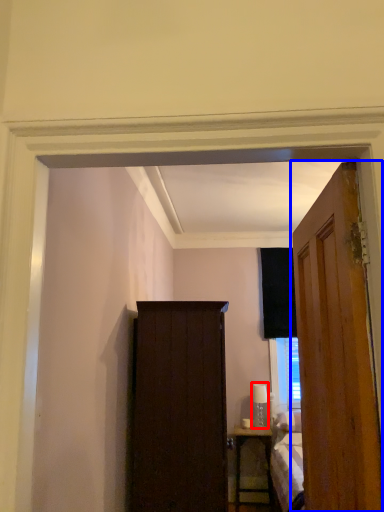
Question: Which point is closer to the camera, lamp (highlighted by a red box) or door (highlighted by a blue box)?

Choices:
 (A) lamp
 (B) door

Answer: (B)